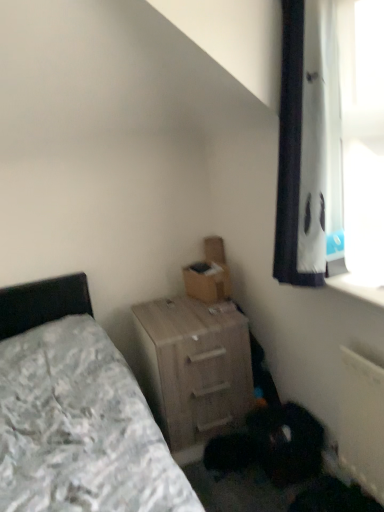
At what (x,y) coordinates should I click in order to perform the action: click on light wood nightstand at lower center. Please return your answer as a coordinate pair (x, y). Image resolution: width=384 pixels, height=512 pixels. Looking at the image, I should click on (196, 366).

The width and height of the screenshot is (384, 512). What do you see at coordinates (196, 366) in the screenshot?
I see `light wood nightstand at lower center` at bounding box center [196, 366].

Measure the distance between brown cardboard box at center and camera.

brown cardboard box at center and camera are 2.21 meters apart from each other.

You are a GUI agent. You are given a task and a screenshot of the screen. Output one action in this format:
    pyautogui.click(x=<x>, y=<y>)
    Task: Click on the brown cardboard box at center
    
    Given the screenshot: What is the action you would take?
    pyautogui.click(x=209, y=274)

The height and width of the screenshot is (512, 384). Describe the element at coordinates (209, 274) in the screenshot. I see `brown cardboard box at center` at that location.

In order to click on light wood nightstand at lower center in this screenshot , I will do `click(196, 366)`.

Is light wood nightstand at lower center to the left of brown cardboard box at center from the viewer's perspective?

Yes, light wood nightstand at lower center is to the left of brown cardboard box at center.

Which object is closer to the camera taking this photo, light wood nightstand at lower center or brown cardboard box at center?

light wood nightstand at lower center is closer to the camera.

Considering the positions of points (198, 322) and (216, 258), is point (198, 322) farther from camera compared to point (216, 258)?

No.

From the image's perspective, who appears lower, light wood nightstand at lower center or brown cardboard box at center?

light wood nightstand at lower center.

From a real-world perspective, is light wood nightstand at lower center located higher than brown cardboard box at center?

Incorrect, from a real-world perspective, light wood nightstand at lower center is lower than brown cardboard box at center.

Considering the relative sizes of light wood nightstand at lower center and brown cardboard box at center in the image provided, is light wood nightstand at lower center thinner than brown cardboard box at center?

Incorrect, the width of light wood nightstand at lower center is not less than that of brown cardboard box at center.

Considering the relative sizes of light wood nightstand at lower center and brown cardboard box at center in the image provided, is light wood nightstand at lower center shorter than brown cardboard box at center?

No.

Considering the sizes of objects light wood nightstand at lower center and brown cardboard box at center in the image provided, who is smaller, light wood nightstand at lower center or brown cardboard box at center?

With smaller size is brown cardboard box at center.

Would you say light wood nightstand at lower center is inside or outside brown cardboard box at center?

light wood nightstand at lower center is not enclosed by brown cardboard box at center.

Are light wood nightstand at lower center and brown cardboard box at center located far from each other?

They are positioned close to each other.

Could you tell me if light wood nightstand at lower center is facing brown cardboard box at center?

No, light wood nightstand at lower center is not turned towards brown cardboard box at center.

The width and height of the screenshot is (384, 512). I want to click on nightstand lying below the brown cardboard box at center (from the image's perspective), so click(196, 366).

Would you say brown cardboard box at center is to the left or to the right of light wood nightstand at lower center in the picture?

brown cardboard box at center is to the right of light wood nightstand at lower center.

Looking at this image, considering their positions, is brown cardboard box at center located in front of or behind light wood nightstand at lower center?

brown cardboard box at center is positioned farther from the viewer than light wood nightstand at lower center.

Between point (211, 254) and point (189, 426), which one is positioned in front?

Point (189, 426)

From the image's perspective, is brown cardboard box at center below light wood nightstand at lower center?

No, from the image's perspective, brown cardboard box at center is not below light wood nightstand at lower center.

From a real-world perspective, is brown cardboard box at center physically located above or below light wood nightstand at lower center?

Clearly, from a real-world perspective, brown cardboard box at center is above light wood nightstand at lower center.

Considering the relative sizes of brown cardboard box at center and light wood nightstand at lower center in the image provided, is brown cardboard box at center thinner than light wood nightstand at lower center?

Correct, the width of brown cardboard box at center is less than that of light wood nightstand at lower center.

Can you confirm if brown cardboard box at center is shorter than light wood nightstand at lower center?

Yes.

Which of these two, brown cardboard box at center or light wood nightstand at lower center, is bigger?

light wood nightstand at lower center.

Is light wood nightstand at lower center located within brown cardboard box at center?

Actually, light wood nightstand at lower center is outside brown cardboard box at center.

Would you consider brown cardboard box at center to be distant from light wood nightstand at lower center?

brown cardboard box at center is near light wood nightstand at lower center, not far away.

Is brown cardboard box at center positioned with its back to light wood nightstand at lower center?

No, brown cardboard box at center's orientation is not away from light wood nightstand at lower center.

What's the angular difference between brown cardboard box at center and light wood nightstand at lower center's facing directions?

The angle between the facing direction of brown cardboard box at center and the facing direction of light wood nightstand at lower center is 74.8 degrees.

Image resolution: width=384 pixels, height=512 pixels. I want to click on cardboard box behind the light wood nightstand at lower center, so click(209, 274).

This screenshot has width=384, height=512. What are the coordinates of `cardboard box above the light wood nightstand at lower center (from the image's perspective)` in the screenshot? It's located at (209, 274).

Where is `nightstand in front of the brown cardboard box at center`? This screenshot has width=384, height=512. nightstand in front of the brown cardboard box at center is located at coordinates (196, 366).